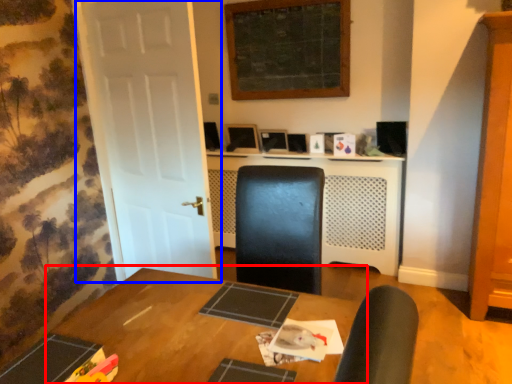
Question: Among these objects, which one is farthest to the camera, table (highlighted by a red box) or door (highlighted by a blue box)?

Choices:
 (A) table
 (B) door

Answer: (B)